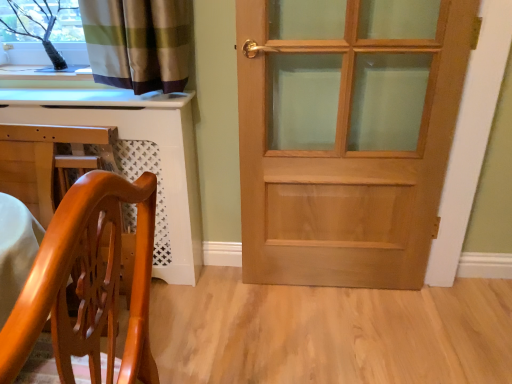
Question: Can you confirm if light brown wooden door at center is bigger than white glossy computer desk at lower left?

Choices:
 (A) no
 (B) yes

Answer: (A)

Question: Does light brown wooden door at center have a greater height compared to white glossy computer desk at lower left?

Choices:
 (A) no
 (B) yes

Answer: (B)

Question: Is there a large distance between light brown wooden door at center and white glossy computer desk at lower left?

Choices:
 (A) no
 (B) yes

Answer: (A)

Question: From the image's perspective, is light brown wooden door at center over white glossy computer desk at lower left?

Choices:
 (A) yes
 (B) no

Answer: (A)

Question: Is the position of light brown wooden door at center less distant than that of white glossy computer desk at lower left?

Choices:
 (A) yes
 (B) no

Answer: (A)

Question: Considering the positions of light brown wooden door at center and white glossy computer desk at lower left in the image, is light brown wooden door at center bigger or smaller than white glossy computer desk at lower left?

Choices:
 (A) small
 (B) big

Answer: (A)

Question: Considering the positions of light brown wooden door at center and white glossy computer desk at lower left in the image, is light brown wooden door at center taller or shorter than white glossy computer desk at lower left?

Choices:
 (A) short
 (B) tall

Answer: (B)

Question: Considering the positions of light brown wooden door at center and white glossy computer desk at lower left in the image, is light brown wooden door at center wider or thinner than white glossy computer desk at lower left?

Choices:
 (A) thin
 (B) wide

Answer: (A)

Question: Considering the positions of point (409, 208) and point (181, 218), is point (409, 208) closer or farther from the camera than point (181, 218)?

Choices:
 (A) farther
 (B) closer

Answer: (B)

Question: Based on their positions, is white glossy computer desk at lower left located to the left or right of glossy wood chair at lower left?

Choices:
 (A) left
 (B) right

Answer: (A)

Question: Is point (117, 142) closer or farther from the camera than point (15, 336)?

Choices:
 (A) farther
 (B) closer

Answer: (A)

Question: From a real-world perspective, is white glossy computer desk at lower left positioned above or below glossy wood chair at lower left?

Choices:
 (A) below
 (B) above

Answer: (A)

Question: From the image's perspective, is white glossy computer desk at lower left positioned above or below glossy wood chair at lower left?

Choices:
 (A) below
 (B) above

Answer: (B)

Question: From the image's perspective, is glossy wood chair at lower left located above or below white glossy computer desk at lower left?

Choices:
 (A) above
 (B) below

Answer: (B)

Question: Is point (96, 258) closer or farther from the camera than point (159, 162)?

Choices:
 (A) farther
 (B) closer

Answer: (B)